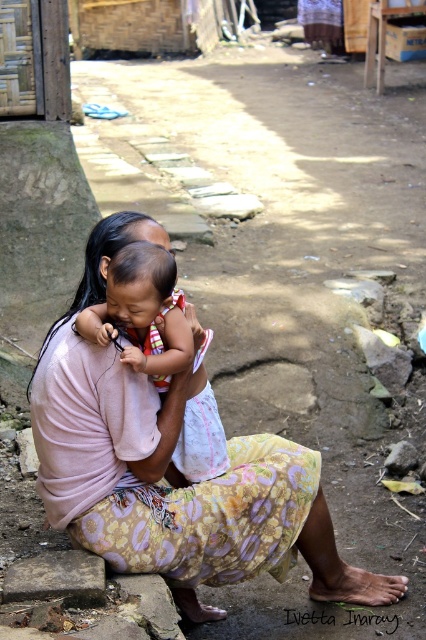
Question: Is patterned fabric baby at center smaller than soft pink fabric baby at center?

Choices:
 (A) no
 (B) yes

Answer: (A)

Question: Can you confirm if patterned fabric baby at center is wider than soft pink fabric baby at center?

Choices:
 (A) yes
 (B) no

Answer: (A)

Question: Can you confirm if patterned fabric baby at center is smaller than soft pink fabric baby at center?

Choices:
 (A) no
 (B) yes

Answer: (A)